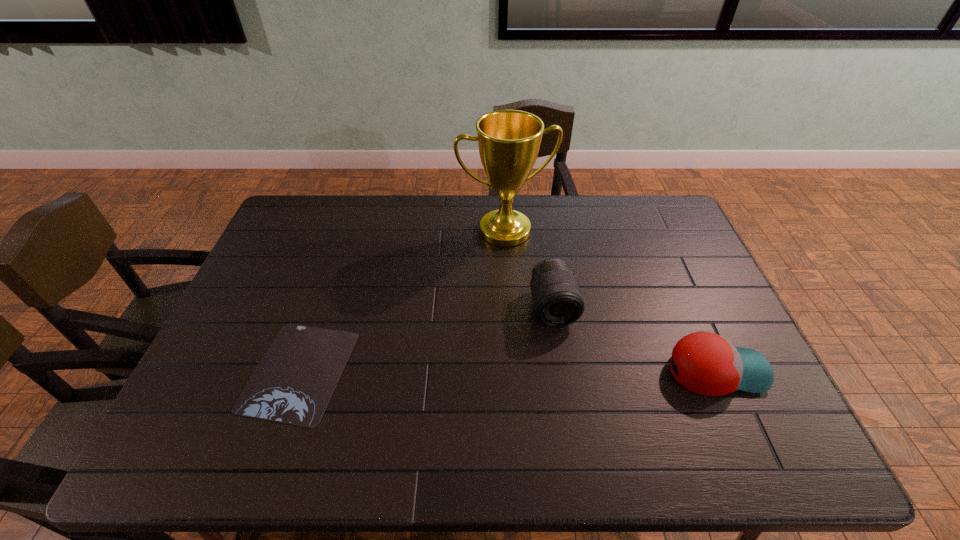
Where is `blank area in the image that satisfies the following two spatial constraints: 1. on the back side of the shortest object; 2. on the right side of the award`? This screenshot has width=960, height=540. blank area in the image that satisfies the following two spatial constraints: 1. on the back side of the shortest object; 2. on the right side of the award is located at coordinates (347, 231).

Find the location of a particular element. Image resolution: width=960 pixels, height=540 pixels. vacant area that satisfies the following two spatial constraints: 1. on the front side of the tallest object; 2. on the left side of the telephoto lens is located at coordinates (510, 307).